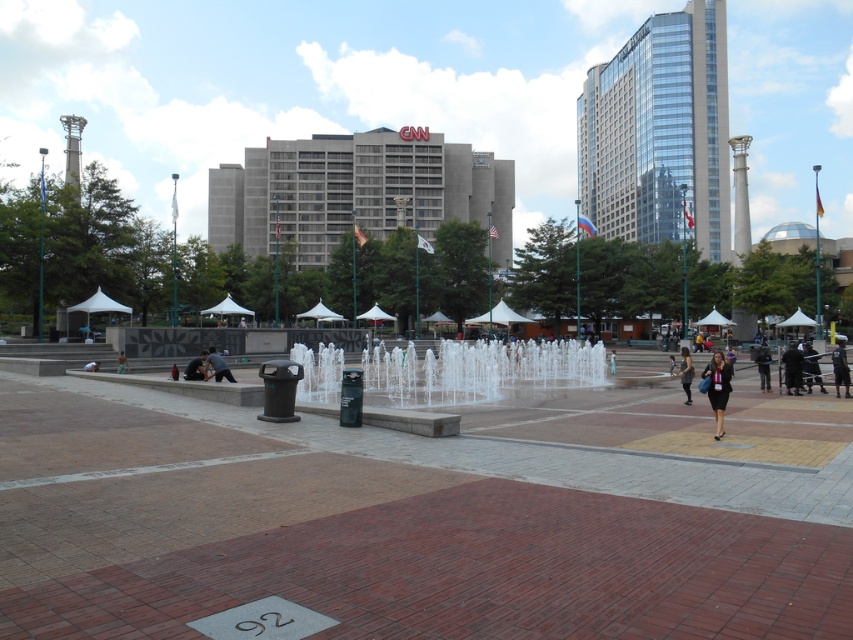
Does silver metallic plaque at lower center have a greater width compared to dark hair person at center?

Indeed, silver metallic plaque at lower center has a greater width compared to dark hair person at center.

Between silver metallic plaque at lower center and dark hair person at center, which one has less height?

silver metallic plaque at lower center is shorter.

Which is behind, point (239, 637) or point (199, 365)?

The point (199, 365) is behind.

This screenshot has height=640, width=853. In order to click on silver metallic plaque at lower center in this screenshot , I will do `click(263, 620)`.

Can you confirm if clear glass water at center is bigger than green fabric person at lower left?

Correct, clear glass water at center is larger in size than green fabric person at lower left.

Is clear glass water at center shorter than green fabric person at lower left?

No, clear glass water at center is not shorter than green fabric person at lower left.

This screenshot has height=640, width=853. Describe the element at coordinates (477, 369) in the screenshot. I see `clear glass water at center` at that location.

Locate an element on the screen. clear glass water at center is located at coordinates (477, 369).

Is dark gray fabric jacket at lower right wider than dark blue jacket at lower right?

Correct, the width of dark gray fabric jacket at lower right exceeds that of dark blue jacket at lower right.

Is dark gray fabric jacket at lower right in front of dark blue jacket at lower right?

Yes, it is in front of dark blue jacket at lower right.

Which is behind, point (796, 355) or point (762, 346)?

Point (762, 346)

Where is `dark gray fabric jacket at lower right`? The width and height of the screenshot is (853, 640). dark gray fabric jacket at lower right is located at coordinates [x=792, y=368].